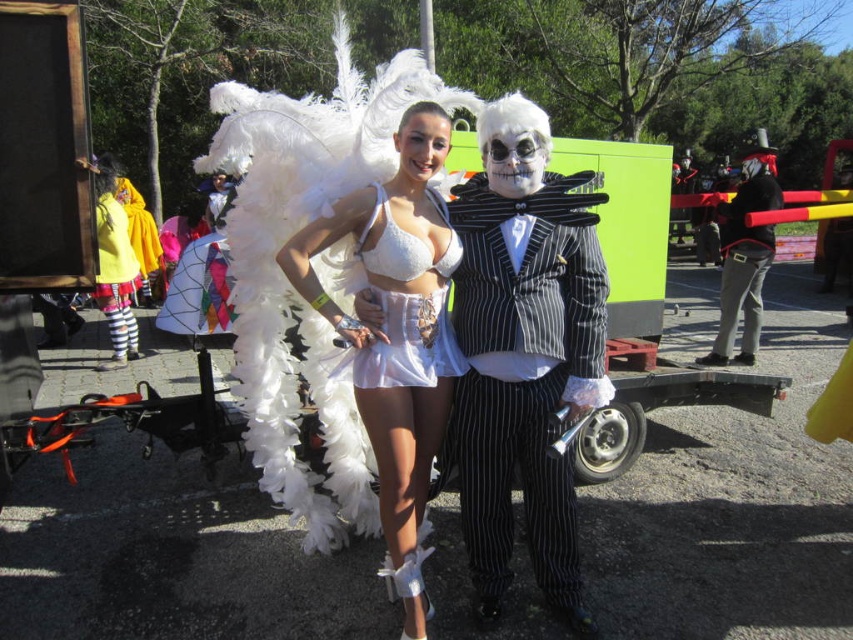
You are a photographer at the festival and need to position the matte black suit at center and the white satin dress at center for a photo. Based on their current positions, which costume is positioned to the right side of the other?

The matte black suit at center is to the right of the white satin dress at center, so the matte black suit at center is positioned to the right of the white satin dress at center.

Looking at this image, you are a photographer trying to capture both the white feathered costume with large wings and the black and white striped suit in a single shot. You notice two points marked in the scene at coordinates point (544, 499) and point (392, 324). Which point is closer to your camera lens?

Point (544, 499) is further to the camera than point (392, 324), so the point closer to the camera lens is point (392, 324).